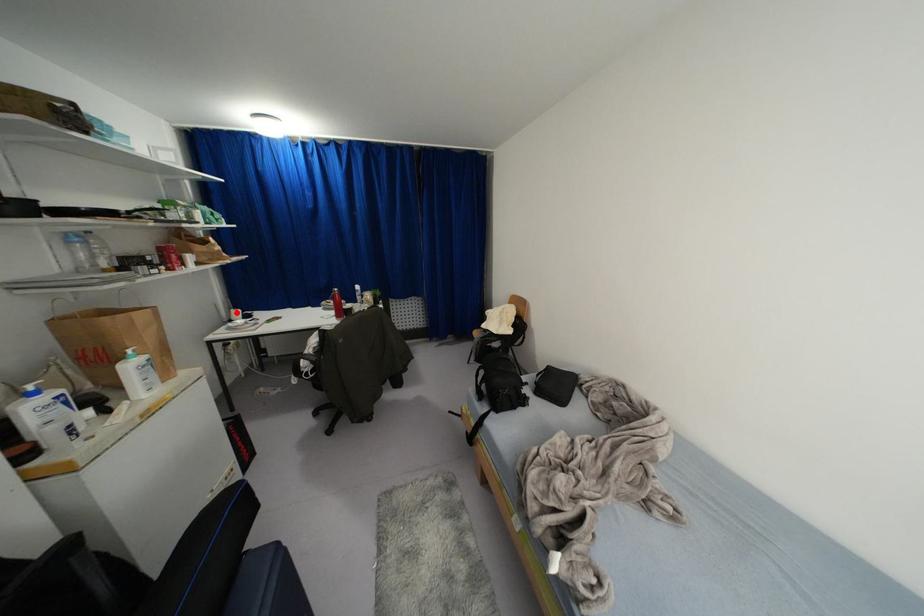
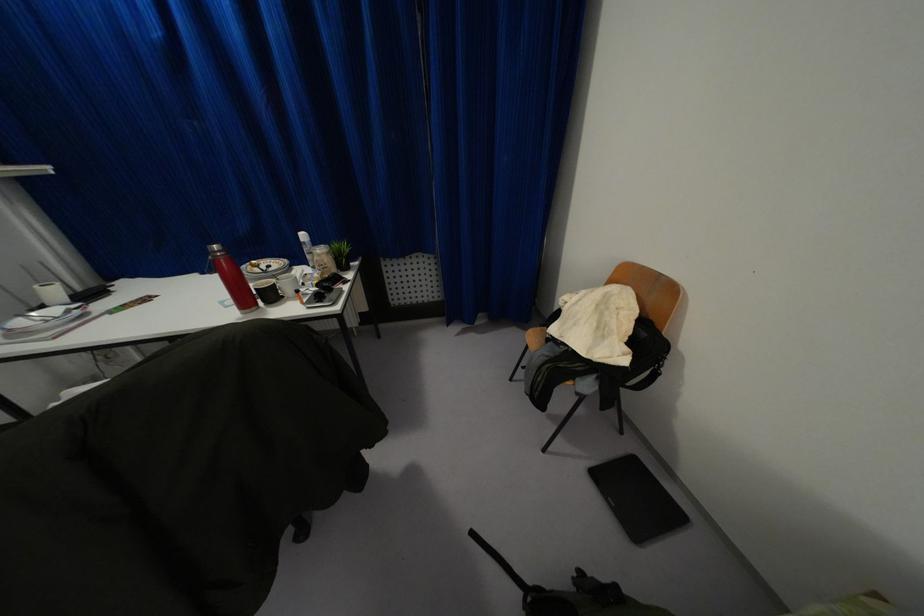
Question: I am providing you with two images of the same scene from different viewpoints. A red point is marked on the first image. Is the red point's position out of view in image 2?

Choices:
 (A) Yes
 (B) No

Answer: (B)